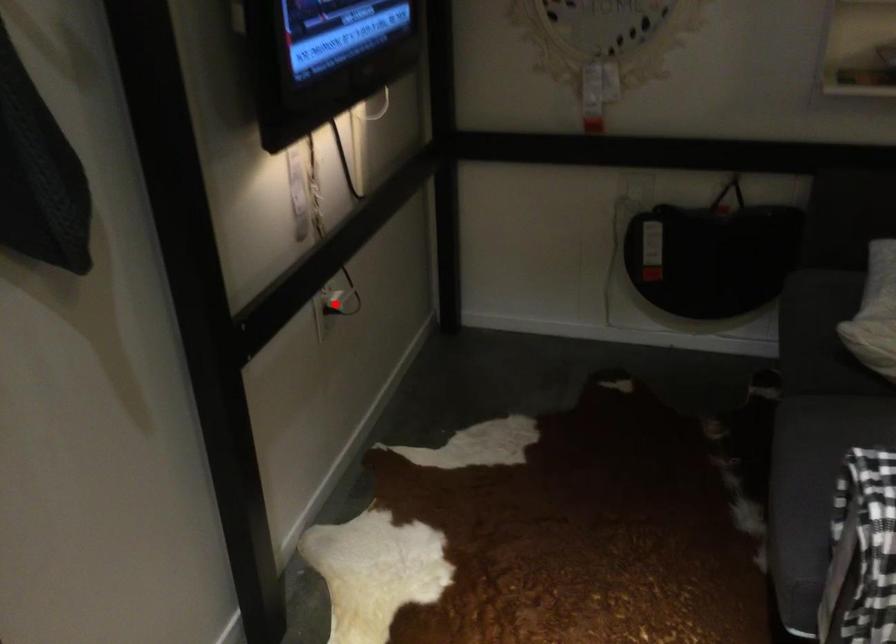
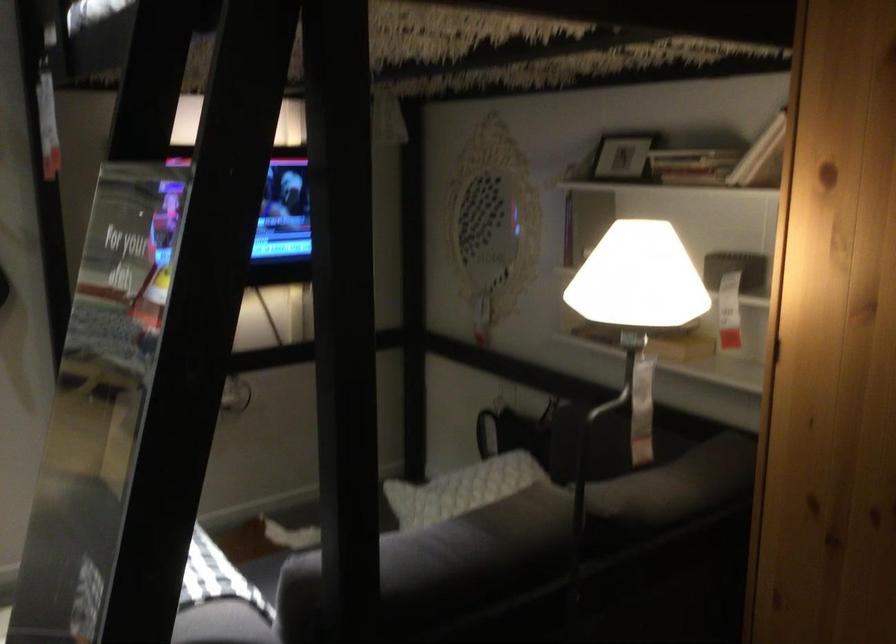
Question: I am providing you with two images of the same scene from different viewpoints. A red point is marked on the first image. Is the red point's position out of view in image 2?

Choices:
 (A) Yes
 (B) No

Answer: (A)